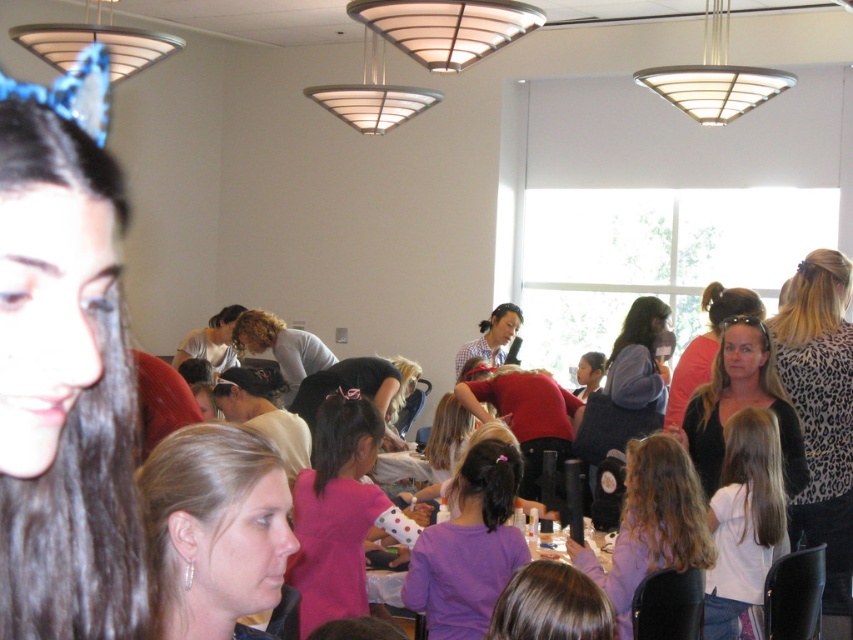
Question: Is light brown hair at center wider than smooth brown hair at center?

Choices:
 (A) no
 (B) yes

Answer: (A)

Question: Which is nearer to the blonde hair at center?

Choices:
 (A) black leopard print top at center
 (B) white matte shirt at lower right

Answer: (A)

Question: Does purple fabric shirt at lower center appear on the right side of matte red shirt at center?

Choices:
 (A) no
 (B) yes

Answer: (B)

Question: Which is farther from the white matte shirt at lower right?

Choices:
 (A) leopard print shirt at right
 (B) curly blonde hair at center
 (C) pink polka dot fabric at center
 (D) light gray shirt at center

Answer: (D)

Question: Considering the real-world distances, which object is farthest from the plaid shirt at center?

Choices:
 (A) white matte shirt at lower right
 (B) black leopard print top at center

Answer: (A)

Question: Is leopard print shirt at right wider than curly blonde hair at center?

Choices:
 (A) no
 (B) yes

Answer: (A)